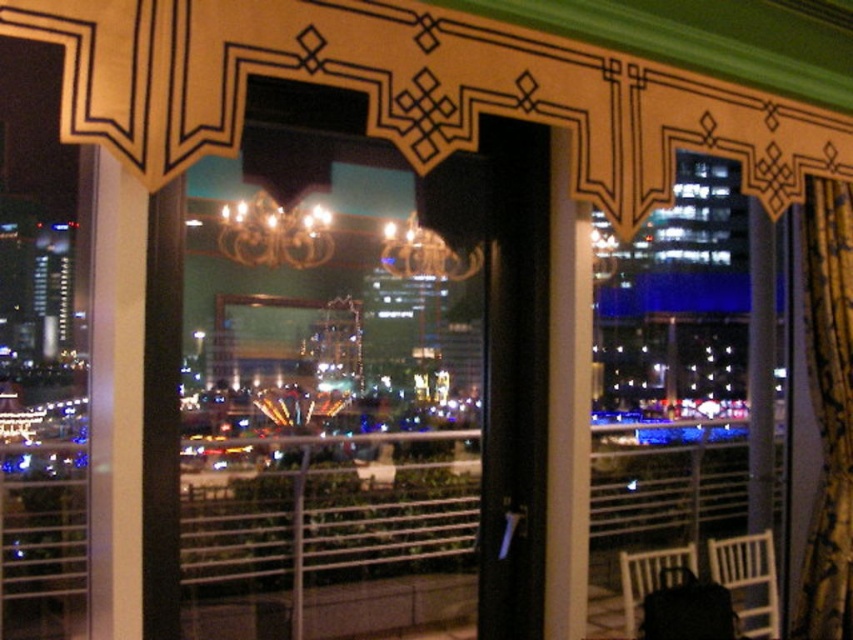
You are standing in the room and want to hang a new picture on the wall between the gold metallic chandelier at upper center and the gold metallic chandelier at center. Can you hang the picture in between them without it overlapping either chandelier?

The gold metallic chandelier at upper center is in front of the gold metallic chandelier at center, so hanging a picture between them might not be possible as their positions may overlap or one is blocking the other.

Based on the photo, you are standing inside the room and want to hang a new painting between the gold textured curtain at right and the gold metallic chandelier at upper center. Is there enough vertical space between them to place the painting?

The gold textured curtain at right is located below the gold metallic chandelier at upper center, so there is vertical space between them to place the painting.